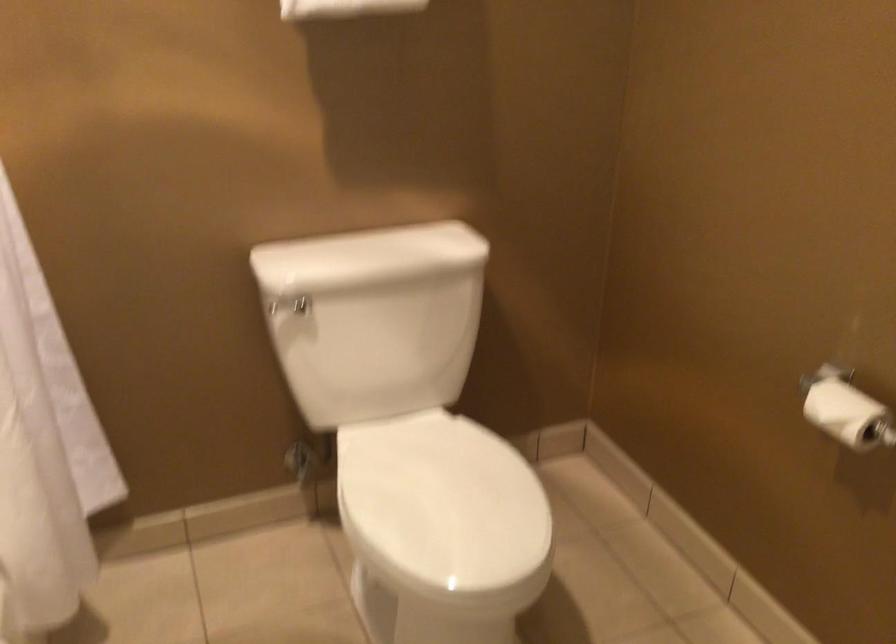
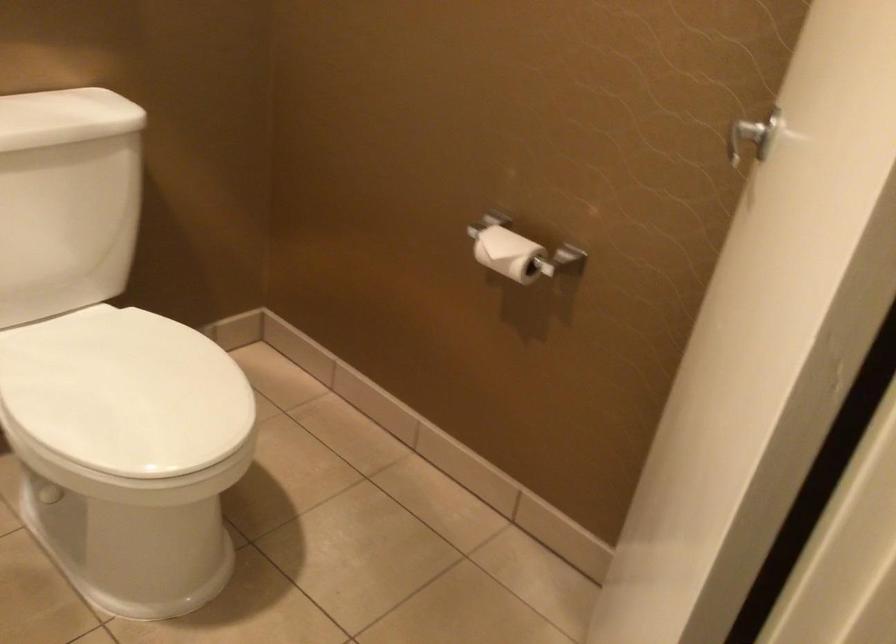
Locate, in the second image, the point that corresponds to (x=435, y=504) in the first image.

(125, 393)